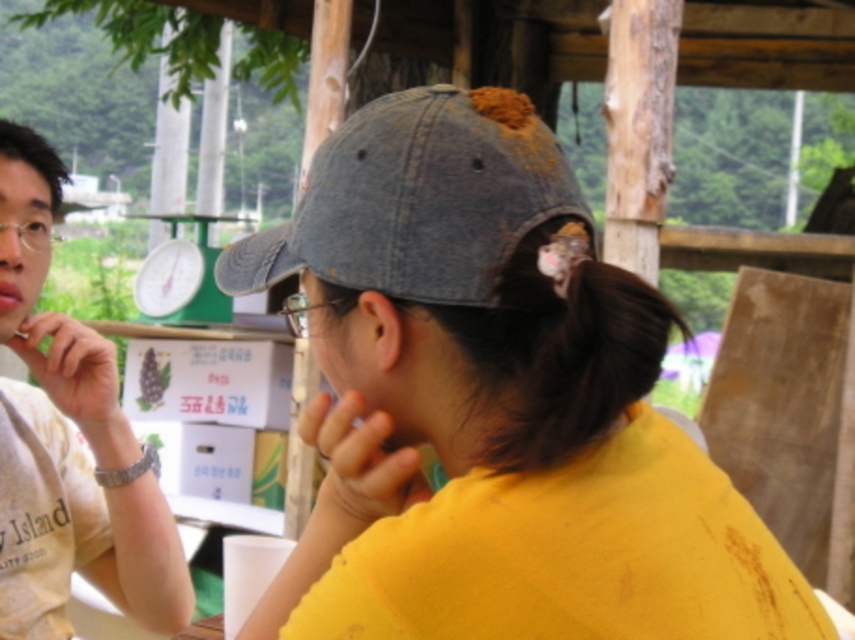
You are standing in front of the wooden structures at the market. You notice two points marked in the scene. Which point, point (x=556, y=188) or point (x=379, y=214), is closer to you?

Point (x=556, y=188) is further to the viewer than point (x=379, y=214), so the closer point to you is point (x=379, y=214).

You are a photographer trying to capture a closeup of the denim baseball cap at center and the pink matte lips at center. The camera can only focus on objects within 30 inches. Will both subjects be in focus?

The denim baseball cap at center is 30.54 inches away from pink matte lips at center, so the distance between them is slightly over the camera focus range of 30 inches. Therefore, both subjects might not be in focus simultaneously.

You are a photographer trying to capture a closeup of the denim baseball cap at center and the pink matte lips at center. Since you want to focus on the cap first, which object should you adjust your camera to prioritize in terms of size in the frame?

The denim baseball cap at center is wider than the pink matte lips at center, so you should prioritize focusing on the denim baseball cap at center first as it occupies more space in the frame.